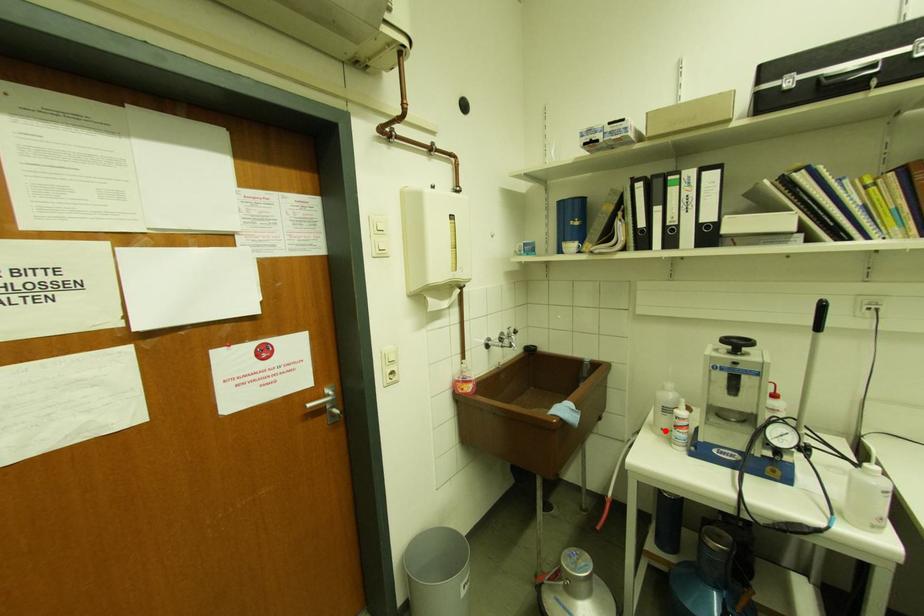
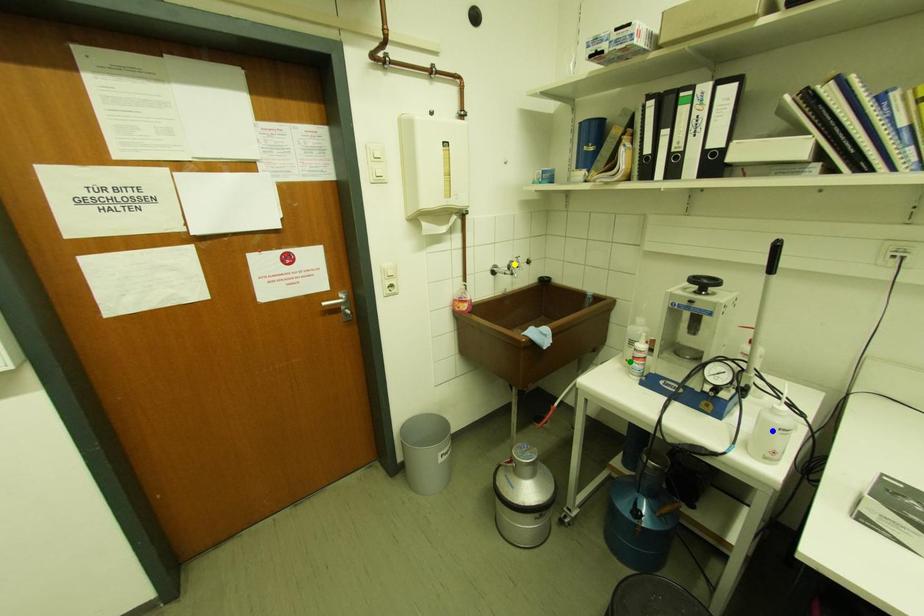
Question: I am providing you with two images of the same scene from different viewpoints. A red point is marked on the first image. You are given multiple points on the second image. Which mark in image 2 goes with the point in image 1?

Choices:
 (A) green point
 (B) yellow point
 (C) blue point

Answer: (A)